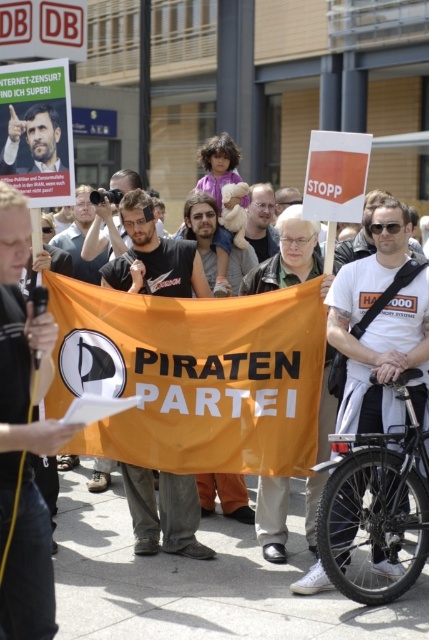
You are a photographer at the protest scene. You want to capture a photo that includes both the black matte bicycle at lower right and the matte black shirt at center. Based on their positions, which object should be placed on the right side of the photo to ensure both are in frame?

The black matte bicycle at lower right is positioned on the right side of matte black shirt at center, so to include both in the photo, the black matte bicycle at lower right should be placed on the right side of the photo.

Based on the photo, you are a photographer trying to capture both the black matte bicycle at lower right and the matte black poster at upper left in a single frame. Given their sizes, which object should you focus on to ensure both are visible without cropping?

Since the black matte bicycle at lower right is bigger than the matte black poster at upper left, you should focus on the black matte bicycle at lower right to ensure both objects are visible in the frame without cropping.